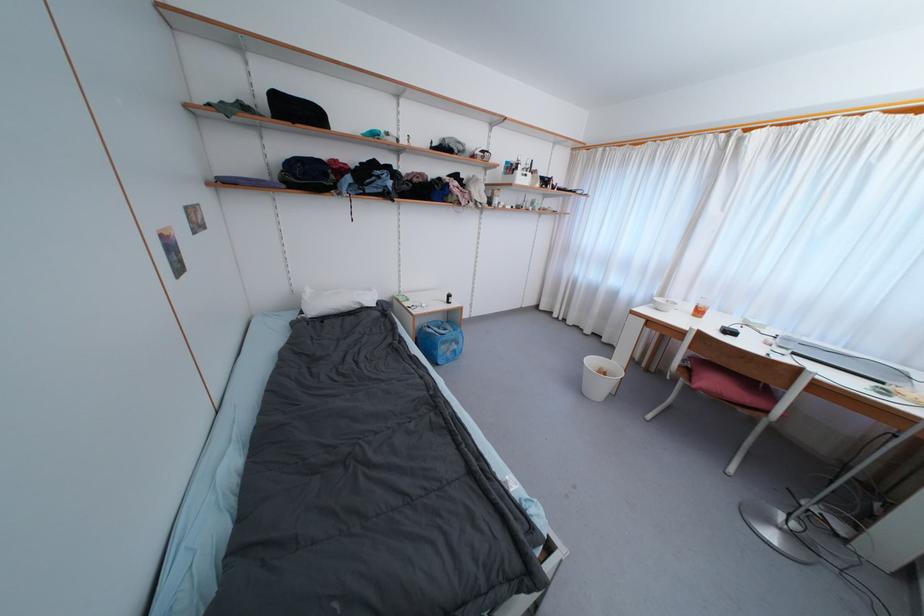
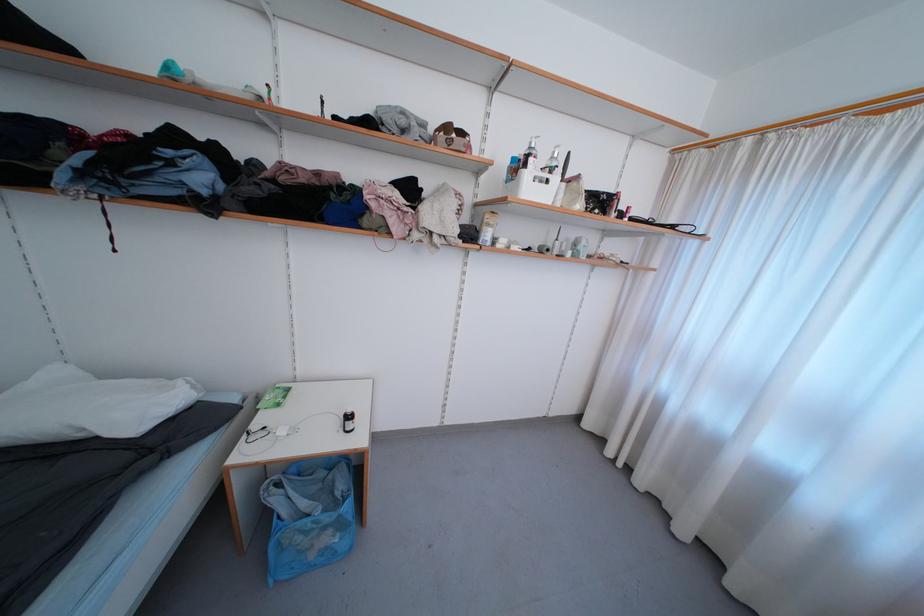
In the second image, find the point that corresponds to (x=541, y=187) in the first image.

(584, 208)